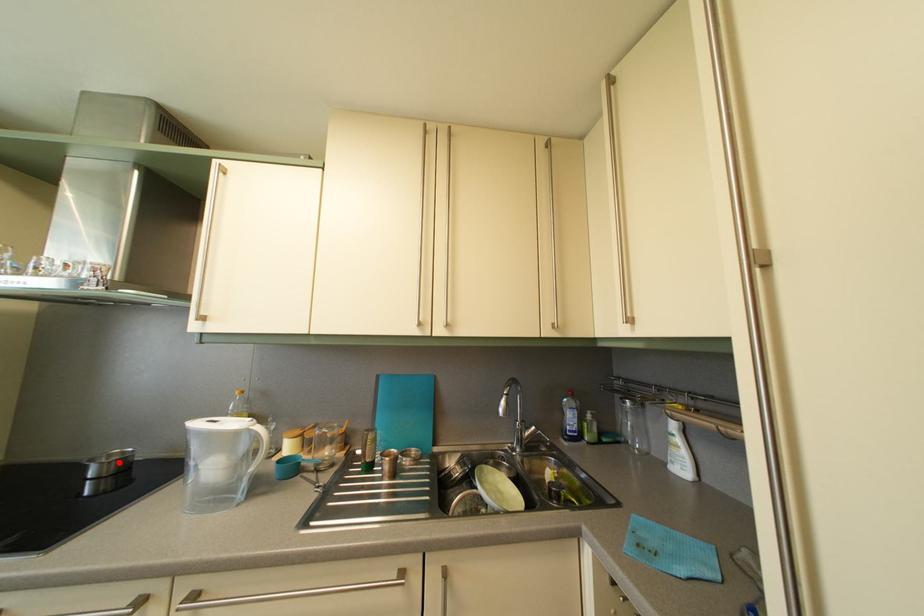
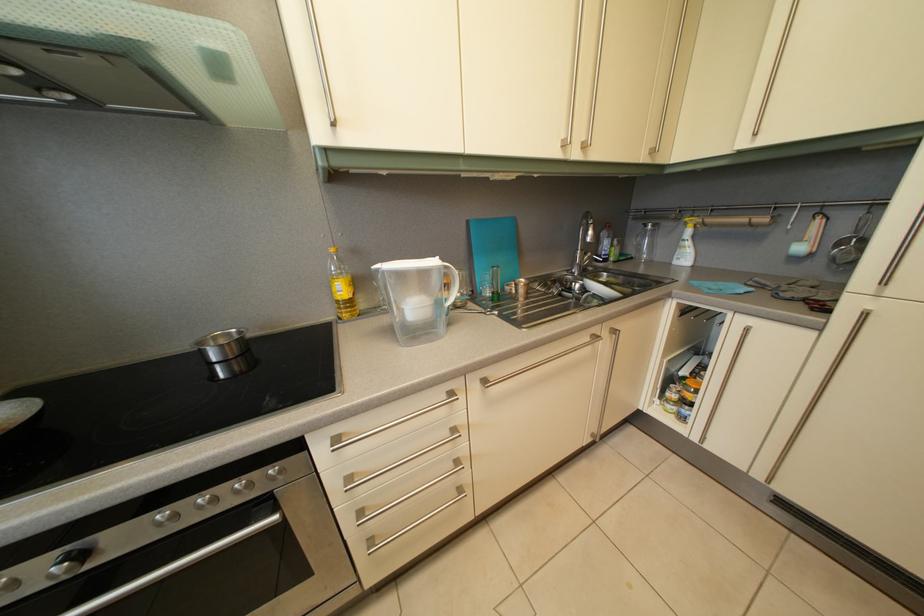
Where in the second image is the point corresponding to the highlighted location from the first image?

(224, 346)